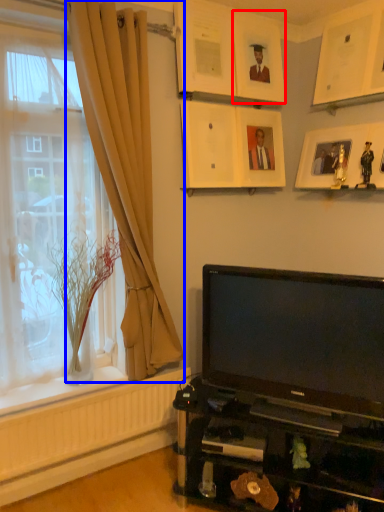
Question: Which object is further to the camera taking this photo, picture frame (highlighted by a red box) or curtain (highlighted by a blue box)?

Choices:
 (A) picture frame
 (B) curtain

Answer: (A)